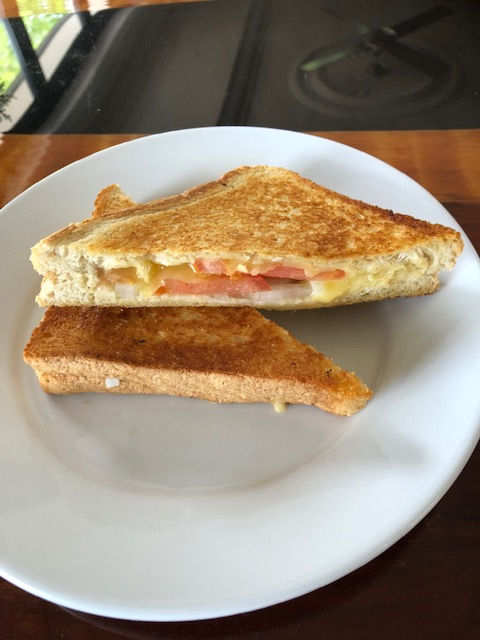
Identify the location of bottom of white plate. click(171, 621).